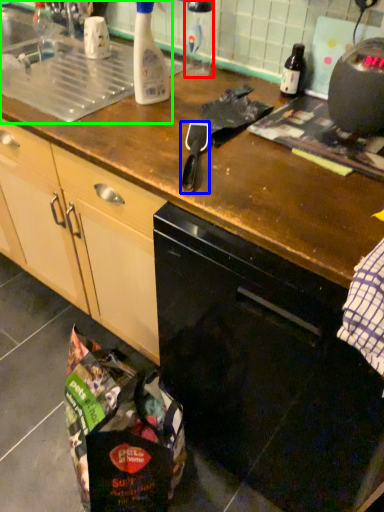
Question: Which is nearer to the bottle (highlighted by a red box)? appliance (highlighted by a blue box) or sink (highlighted by a green box).

Choices:
 (A) appliance
 (B) sink

Answer: (B)